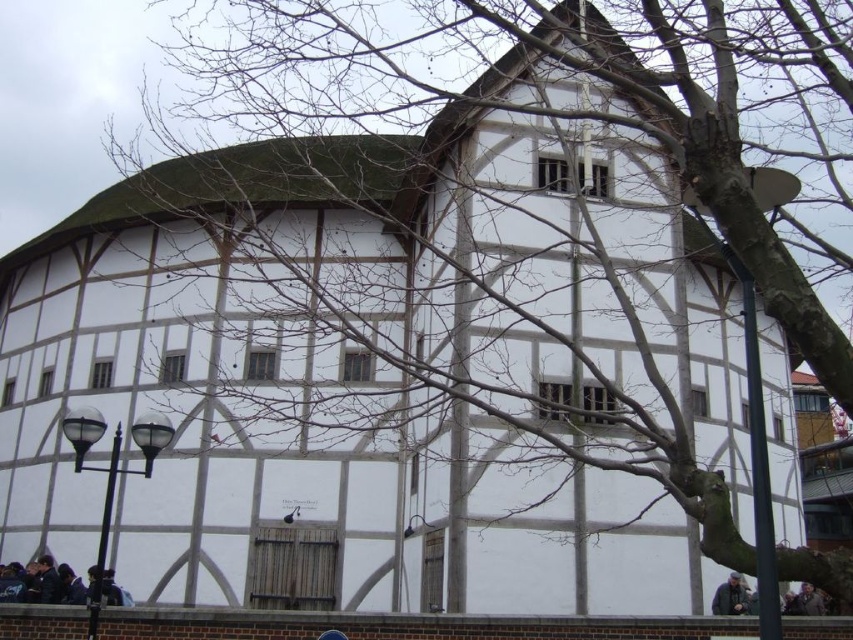
Who is lower down, dark blue jacket at lower left or gray wool coat at lower right?

dark blue jacket at lower left is lower down.

Is point (53, 595) farther from viewer compared to point (811, 589)?

No, (53, 595) is closer to viewer.

In the scene shown: Who is more forward, (45,584) or (791,602)?

Point (45,584) is in front.

At what (x,y) coordinates should I click in order to perform the action: click on dark blue jacket at lower left. Please return your answer as a coordinate pair (x, y). The height and width of the screenshot is (640, 853). Looking at the image, I should click on (51, 584).

Between dark blue jacket at lower left and dark gray jacket at lower right, which one appears on the left side from the viewer's perspective?

dark blue jacket at lower left

Does dark blue jacket at lower left have a greater width compared to dark gray jacket at lower right?

Yes, dark blue jacket at lower left is wider than dark gray jacket at lower right.

Image resolution: width=853 pixels, height=640 pixels. Describe the element at coordinates (51, 584) in the screenshot. I see `dark blue jacket at lower left` at that location.

The width and height of the screenshot is (853, 640). What are the coordinates of `dark blue jacket at lower left` in the screenshot? It's located at (51, 584).

Is dark gray jacket at lower right closer to camera compared to gray wool coat at lower right?

No, it is behind gray wool coat at lower right.

Identify the location of dark gray jacket at lower right. This screenshot has height=640, width=853. (730, 596).